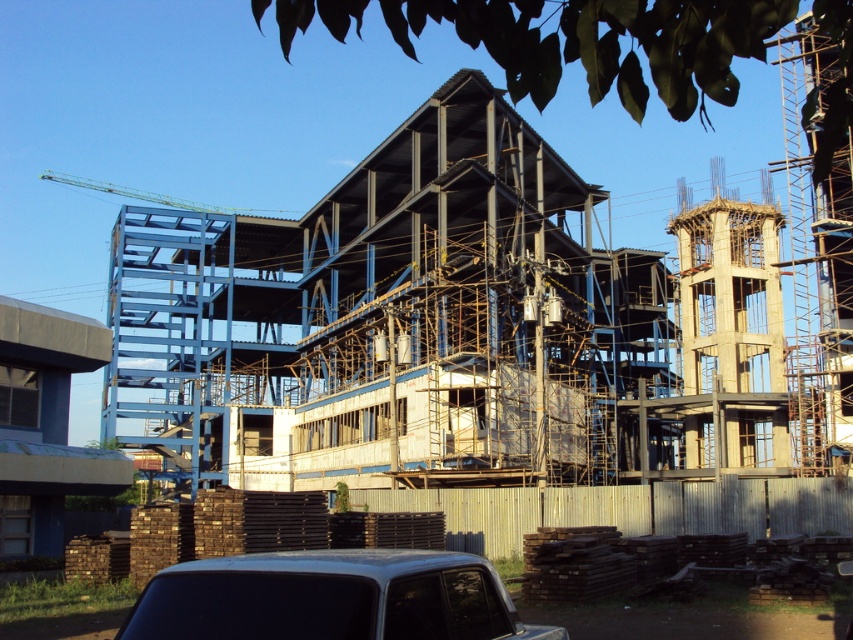
You are a delivery driver arriving at the construction site and need to park your vehicle. Your truck is 3 meters wide. The silver metallic car at lower center and the green metallic crane at upper left are parked nearby. Can your truck fit between them without touching either?

The silver metallic car at lower center has a lesser width compared to green metallic crane at upper left. Since your truck is 3 meters wide, you need to check the available space between them. However, the exact distance between the two objects isn